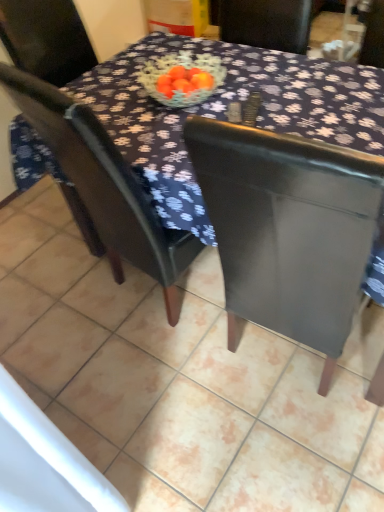
Question: Considering the relative positions of dark fabric table at center and matte black table at center in the image provided, is dark fabric table at center behind matte black table at center?

Choices:
 (A) yes
 (B) no

Answer: (B)

Question: Considering the relative sizes of dark fabric table at center and matte black table at center in the image provided, is dark fabric table at center taller than matte black table at center?

Choices:
 (A) no
 (B) yes

Answer: (B)

Question: Can you confirm if dark fabric table at center is smaller than matte black table at center?

Choices:
 (A) yes
 (B) no

Answer: (B)

Question: Is dark fabric table at center at the right side of matte black table at center?

Choices:
 (A) no
 (B) yes

Answer: (B)

Question: Is dark fabric table at center not within matte black table at center?

Choices:
 (A) yes
 (B) no

Answer: (A)

Question: Is dark fabric table at center turned away from matte black table at center?

Choices:
 (A) yes
 (B) no

Answer: (B)

Question: From a real-world perspective, does matte black table at center stand above matte black chair at center?

Choices:
 (A) no
 (B) yes

Answer: (A)

Question: Is matte black table at center to the left of matte black chair at center from the viewer's perspective?

Choices:
 (A) yes
 (B) no

Answer: (B)

Question: From the image's perspective, does matte black table at center appear lower than matte black chair at center?

Choices:
 (A) yes
 (B) no

Answer: (A)

Question: Is matte black table at center looking in the opposite direction of matte black chair at center?

Choices:
 (A) yes
 (B) no

Answer: (B)

Question: Can you confirm if matte black table at center is thinner than matte black chair at center?

Choices:
 (A) no
 (B) yes

Answer: (A)

Question: Does matte black table at center have a greater height compared to matte black chair at center?

Choices:
 (A) no
 (B) yes

Answer: (A)

Question: Can you confirm if dark fabric table at center is shorter than matte black chair at center?

Choices:
 (A) yes
 (B) no

Answer: (A)